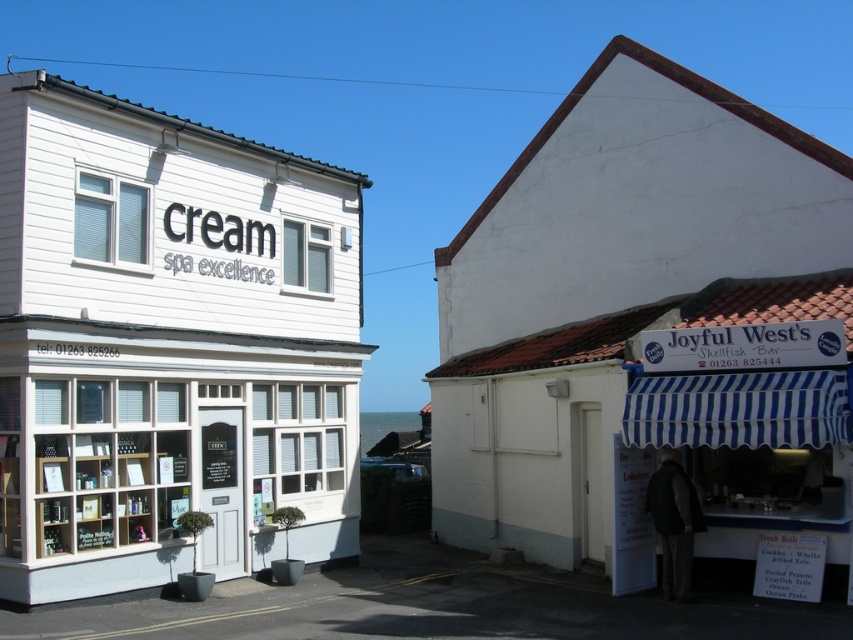
Does white wood cream spa excellence at left have a lesser height compared to white painted wood shed at right?

Correct, white wood cream spa excellence at left is not as tall as white painted wood shed at right.

Find the location of a particular element. This screenshot has width=853, height=640. white wood cream spa excellence at left is located at coordinates (167, 344).